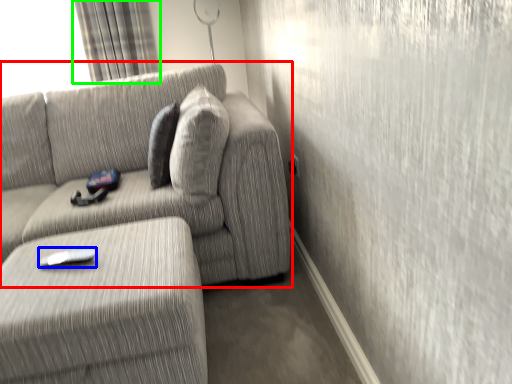
Question: Considering the real-world distances, which object is farthest from studio couch (highlighted by a red box)? remote (highlighted by a blue box) or curtain (highlighted by a green box)?

Choices:
 (A) remote
 (B) curtain

Answer: (B)